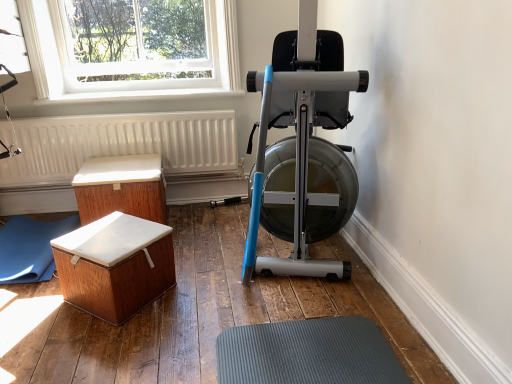
Image resolution: width=512 pixels, height=384 pixels. In order to click on vacant point above white textured radiator at lower left (from a real-world perspective) in this screenshot , I will do `click(74, 114)`.